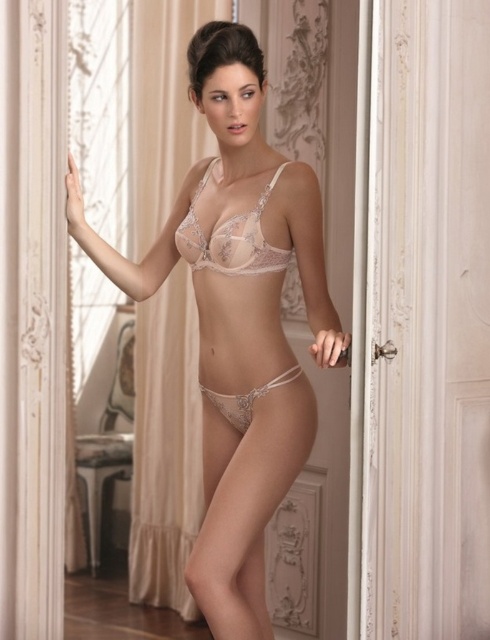
Question: Which object appears farthest from the camera in this image?

Choices:
 (A) translucent lace bikini at center
 (B) translucent lace bikini top at center
 (C) translucent lace lingerie at center

Answer: (A)

Question: Which point appears closest to the camera in this image?

Choices:
 (A) (248, 256)
 (B) (191, 230)

Answer: (A)

Question: From the image, what is the correct spatial relationship of translucent lace lingerie at center in relation to translucent lace bikini at center?

Choices:
 (A) left
 (B) right

Answer: (A)

Question: Where is translucent lace lingerie at center located in relation to translucent lace bikini at center in the image?

Choices:
 (A) right
 (B) left

Answer: (B)

Question: Which point appears farthest from the camera in this image?

Choices:
 (A) (215, 310)
 (B) (197, 220)
 (C) (233, 412)

Answer: (C)

Question: Does translucent lace lingerie at center have a lesser width compared to translucent lace bikini top at center?

Choices:
 (A) yes
 (B) no

Answer: (B)